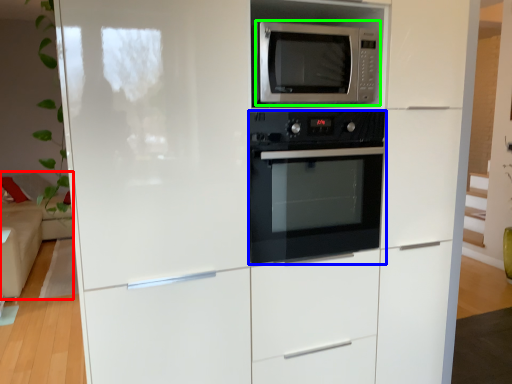
Question: Considering the real-world distances, which object is farthest from couch (highlighted by a red box)? oven (highlighted by a blue box) or microwave oven (highlighted by a green box)?

Choices:
 (A) oven
 (B) microwave oven

Answer: (B)